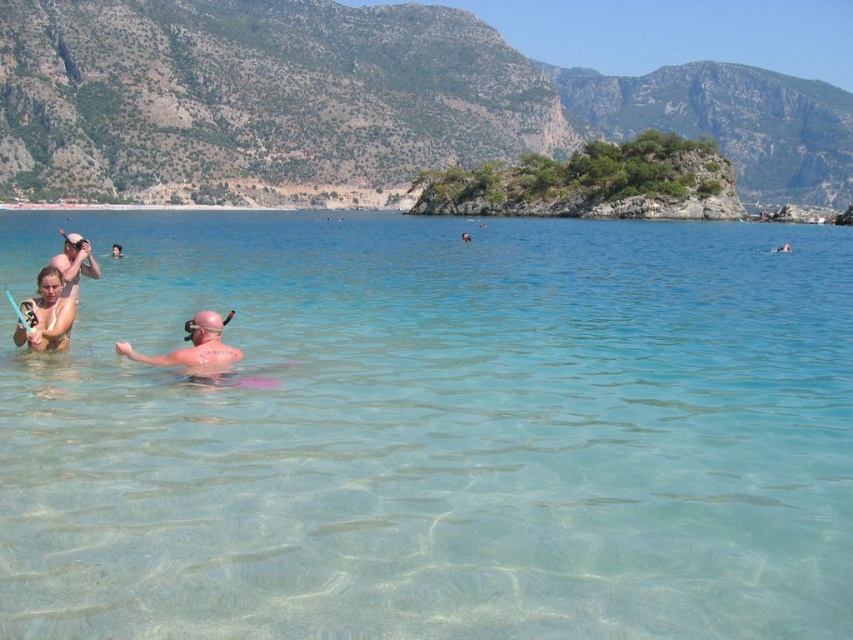
Question: Is matte black bikini at left thinner than matte white swim cap at upper left?

Choices:
 (A) no
 (B) yes

Answer: (B)

Question: Is clear water at center smaller than matte white swim cap at upper left?

Choices:
 (A) yes
 (B) no

Answer: (B)

Question: Observing the image, what is the correct spatial positioning of clear water at center in reference to matte black bikini at left?

Choices:
 (A) above
 (B) below

Answer: (A)

Question: Which point appears farthest from the camera in this image?

Choices:
 (A) (80, 244)
 (B) (113, 308)
 (C) (84, 266)

Answer: (B)

Question: Which of these objects is positioned farthest from the matte white swim cap at upper left?

Choices:
 (A) clear water at center
 (B) matte black bikini at left

Answer: (A)

Question: Which object appears closest to the camera in this image?

Choices:
 (A) clear water at center
 (B) matte black bikini at left
 (C) matte white swim cap at upper left

Answer: (A)